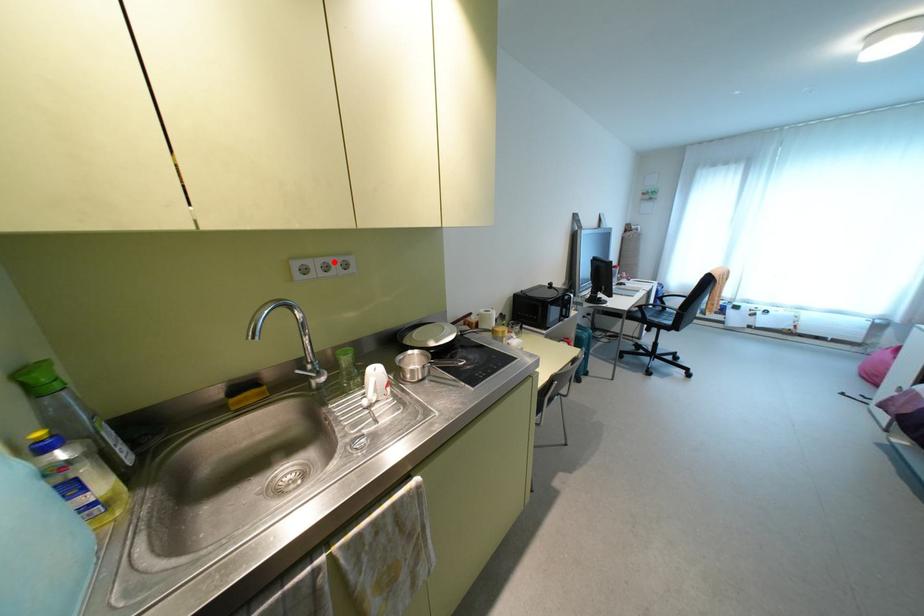
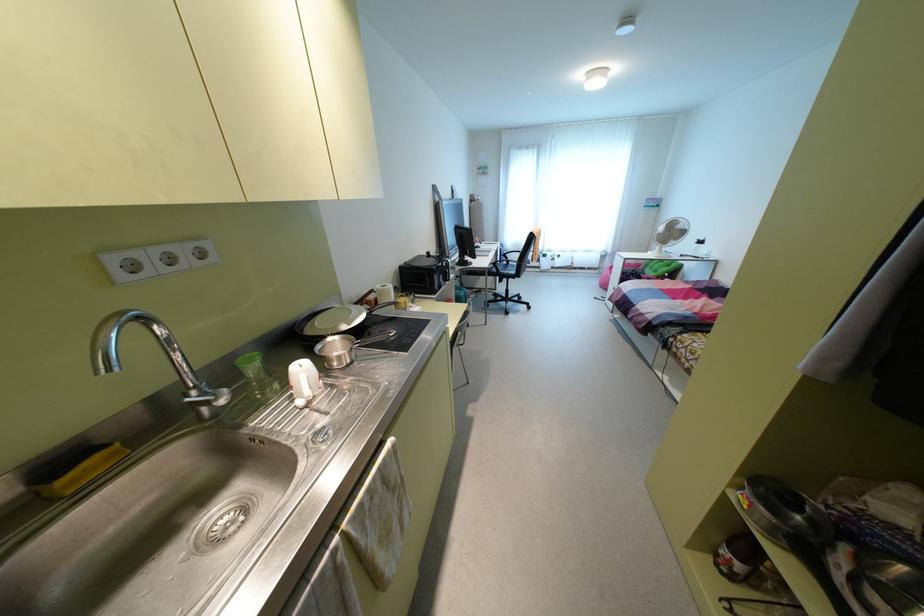
In the second image, find the point that corresponds to the highlighted location in the first image.

(181, 251)